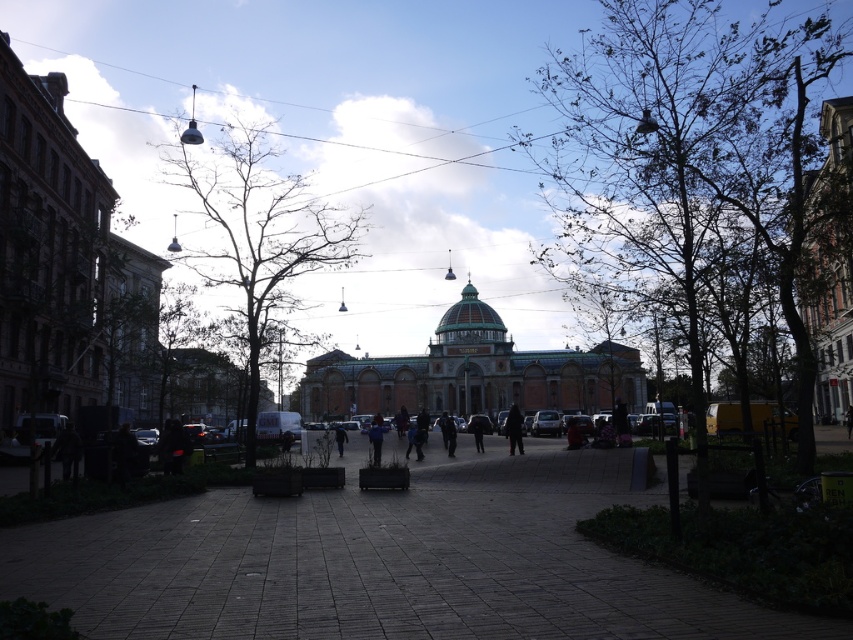
You are a pedestrian standing at the edge of the square. You notice the bare branches at left and the dark blue jacket at center. Which object appears wider from your perspective?

The bare branches at left appears wider than the dark blue jacket at center according to the description.